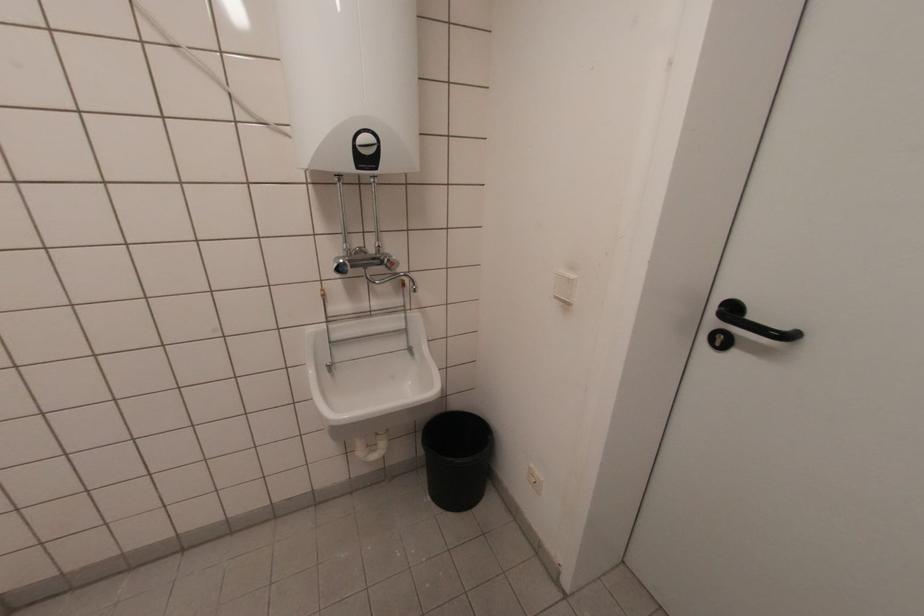
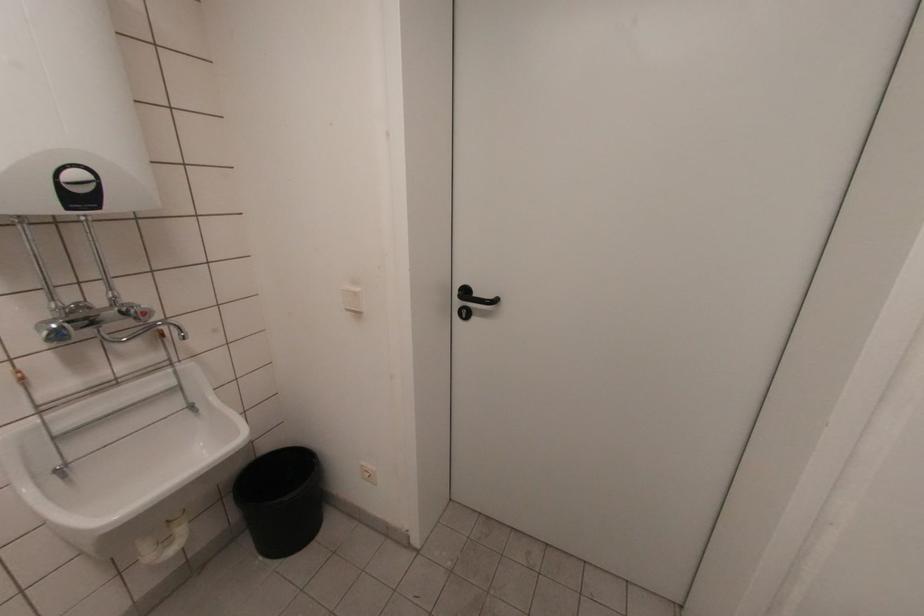
Question: How did the camera likely rotate?

Choices:
 (A) Left
 (B) Right
 (C) Up
 (D) Down

Answer: (B)